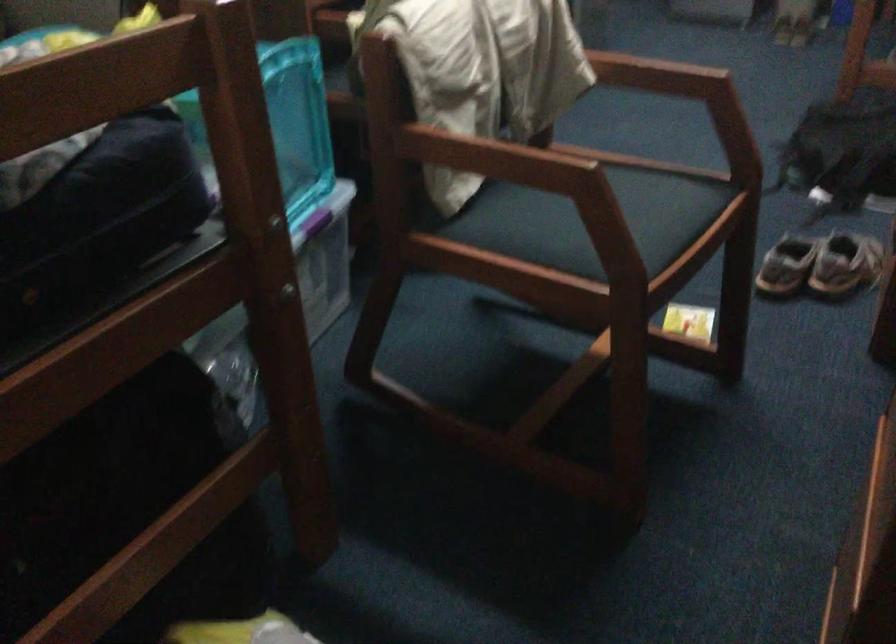
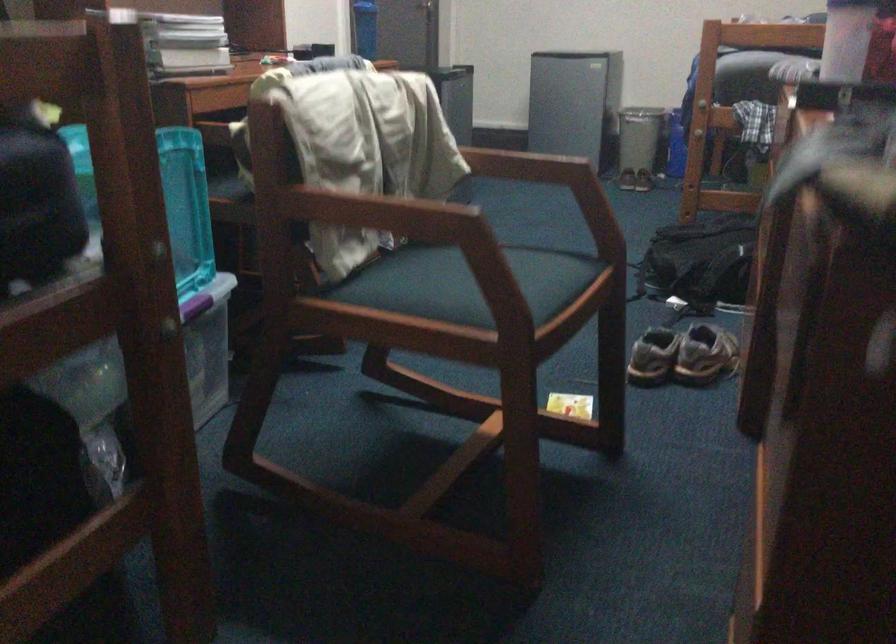
Where in the second image is the point corresponding to pixel 816 269 from the first image?

(682, 355)